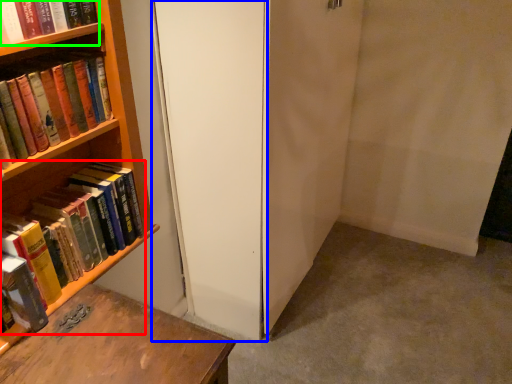
Question: Considering the real-world distances, which object is closest to book (highlighted by a red box)? screen door (highlighted by a blue box) or book (highlighted by a green box).

Choices:
 (A) screen door
 (B) book

Answer: (A)